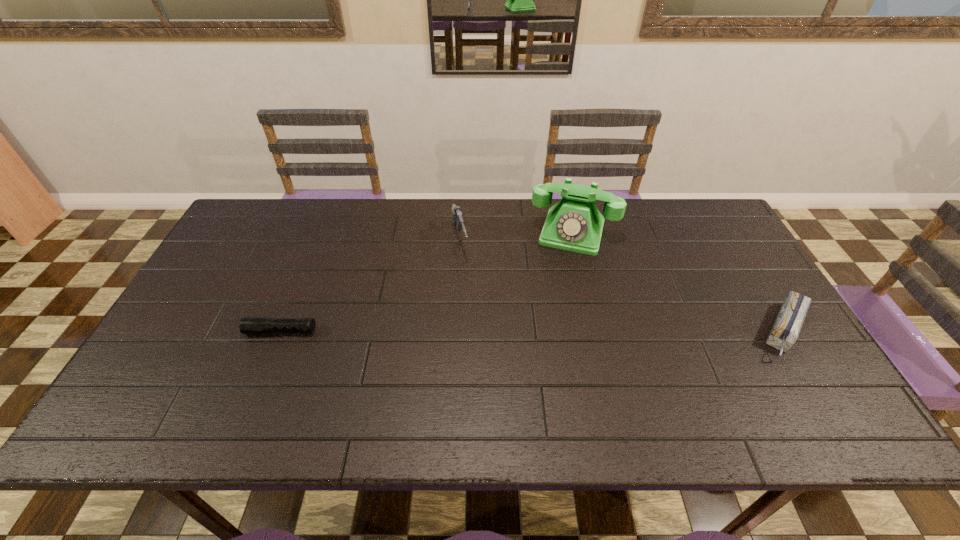
In the image, there is a desktop. At what (x,y) coordinates should I click in order to perform the action: click on vacant space at the far edge. Please return your answer as a coordinate pair (x, y). The image size is (960, 540). Looking at the image, I should click on (333, 241).

Locate an element on the screen. vacant area at the near edge of the desktop is located at coordinates (355, 376).

The image size is (960, 540). In the image, there is a desktop. Identify the location of vacant area at the left edge. (216, 283).

The height and width of the screenshot is (540, 960). Identify the location of blank space at the right edge. (736, 278).

Locate an element on the screen. Image resolution: width=960 pixels, height=540 pixels. free space at the near left corner is located at coordinates (174, 395).

Find the location of a particular element. vacant space at the far right corner of the desktop is located at coordinates (687, 232).

The height and width of the screenshot is (540, 960). What are the coordinates of `vacant area at the near right corner of the desktop` in the screenshot? It's located at (805, 393).

Image resolution: width=960 pixels, height=540 pixels. In order to click on vacant area that lies between the second tallest object and the shortest object in this screenshot , I will do `click(371, 286)`.

This screenshot has width=960, height=540. Identify the location of unoccupied area between the third shortest object and the rightmost object. (622, 286).

Locate an element on the screen. Image resolution: width=960 pixels, height=540 pixels. free space between the telephone and the shortest object is located at coordinates (x=426, y=281).